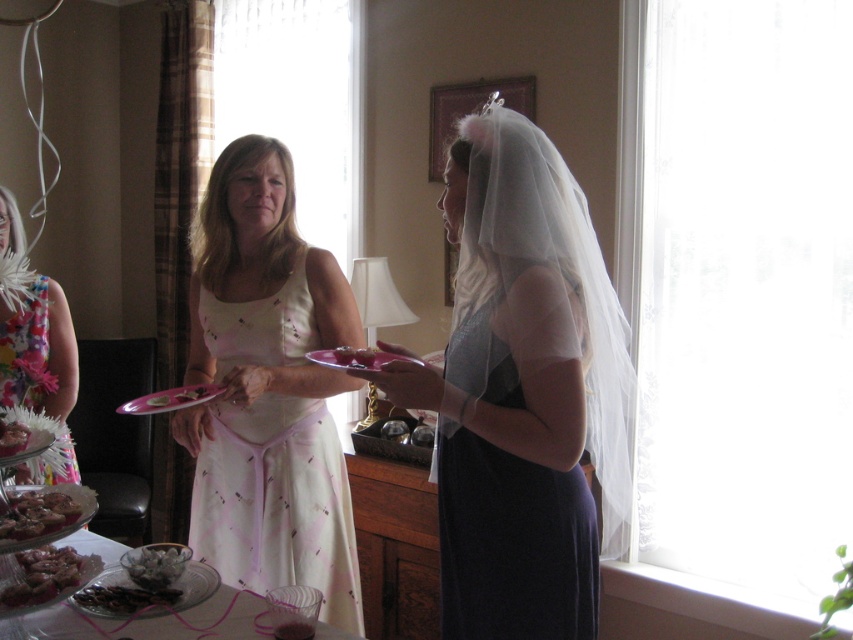
You are a guest at this event and want to place a small dessert on the matte pink plate at center without it touching the translucent glass bowl at lower left. Is the space between them sufficient?

The translucent glass bowl at lower left is much taller than the matte pink plate at center, so there might not be enough horizontal space between them to place the dessert without it touching the bowl. Check the distance carefully.

You are a guest at a wedding reception and want to grab a cookie from the table. You see the translucent glass bowl at lower left and the shiny silver cookie at lower left. Which object is closer to you?

The translucent glass bowl at lower left is closer to you than the shiny silver cookie at lower left.

You are a guest at the wedding reception and you want to grab a cookie from the bowl. Can you reach the shiny silver cookie at lower left without moving the translucent glass bowl at lower left?

The translucent glass bowl at lower left is larger in size than the shiny silver cookie at lower left, so the cookie is likely smaller and accessible without moving the bowl.